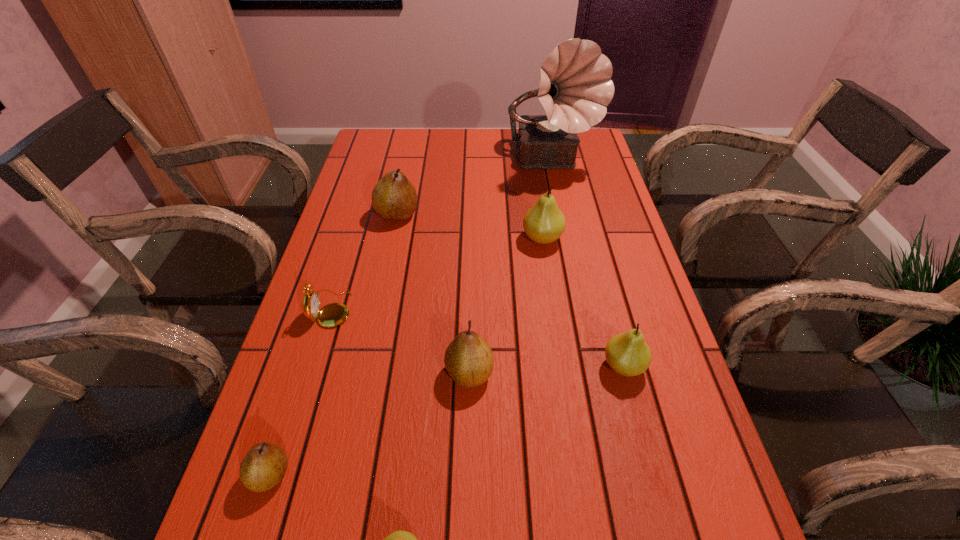
The height and width of the screenshot is (540, 960). I want to click on brown record player, so click(x=575, y=87).

The height and width of the screenshot is (540, 960). Identify the location of the farthest object. (575, 87).

Where is `the second green pear from left to right`? The height and width of the screenshot is (540, 960). the second green pear from left to right is located at coordinates (544, 223).

Where is `the biggest green pear`? Image resolution: width=960 pixels, height=540 pixels. the biggest green pear is located at coordinates coord(544,223).

You are a GUI agent. You are given a task and a screenshot of the screen. Output one action in this format:
    pyautogui.click(x=<x>, y=<y>)
    Task: Click on the second brown pear from right to left
    The image size is (960, 540).
    Given the screenshot: What is the action you would take?
    pyautogui.click(x=394, y=198)

You are a GUI agent. You are given a task and a screenshot of the screen. Output one action in this format:
    pyautogui.click(x=<x>, y=<y>)
    Task: Click on the fifth pear from right to left
    The width and height of the screenshot is (960, 540).
    Given the screenshot: What is the action you would take?
    pyautogui.click(x=394, y=198)

Identify the location of the second smallest brown pear. (469, 361).

Identify the location of the rightmost brown pear. The width and height of the screenshot is (960, 540). (469, 361).

Locate an element on the screen. the rightmost pear is located at coordinates (628, 354).

Where is `the rightmost green pear`? This screenshot has width=960, height=540. the rightmost green pear is located at coordinates (628, 354).